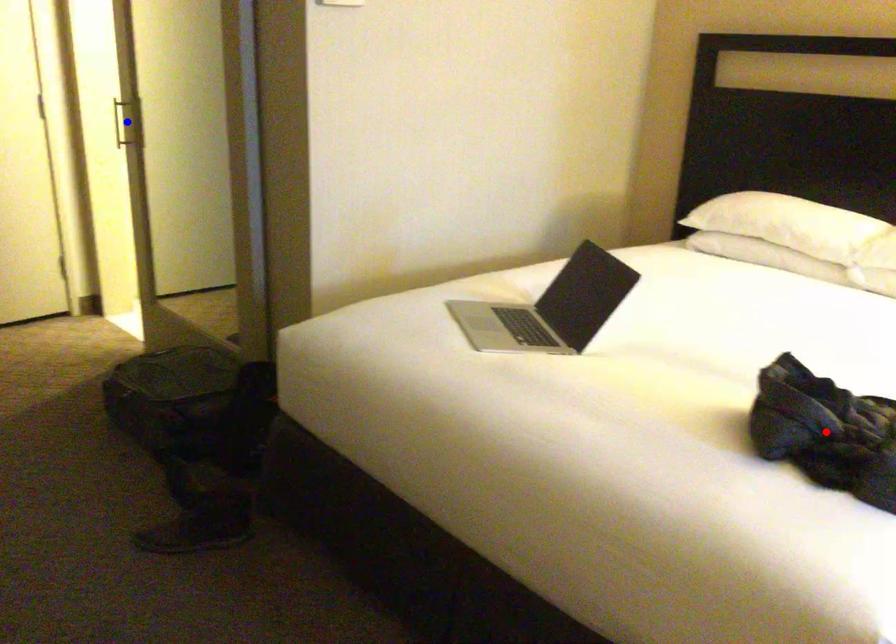
Question: Which of the two points in the image is closer to the camera?

Choices:
 (A) Blue point is closer.
 (B) Red point is closer.

Answer: (B)